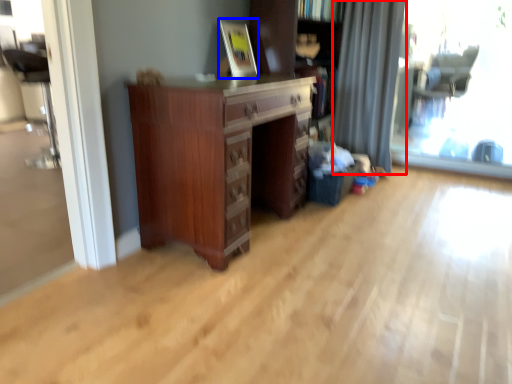
Question: Which of the following is the farthest to the observer, curtain (highlighted by a red box) or picture frame (highlighted by a blue box)?

Choices:
 (A) curtain
 (B) picture frame

Answer: (A)